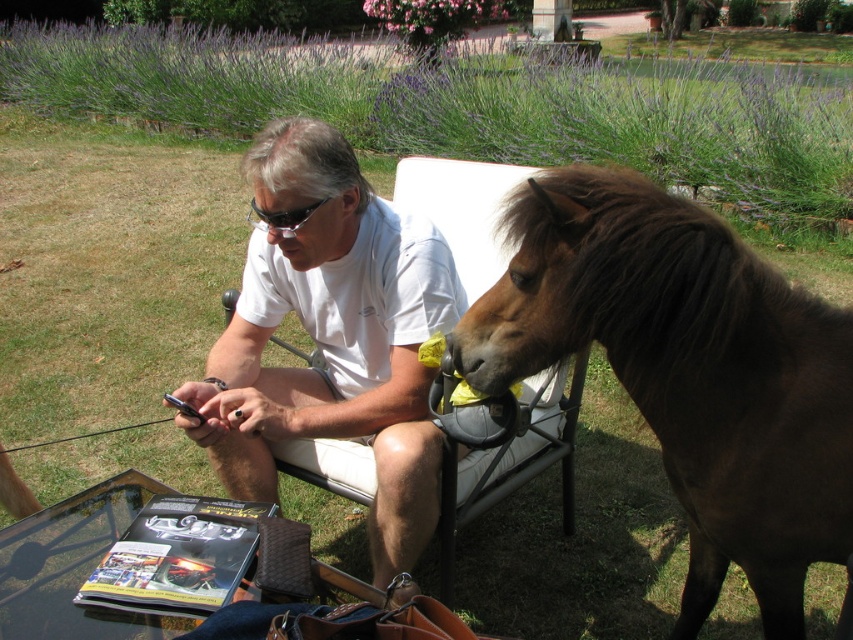
Question: Can you confirm if white cotton shirt at center is positioned to the left of black plastic goggles at center?

Choices:
 (A) yes
 (B) no

Answer: (B)

Question: Can you confirm if brown glossy horse at right is smaller than black plastic goggles at center?

Choices:
 (A) no
 (B) yes

Answer: (A)

Question: Which point appears farthest from the camera in this image?

Choices:
 (A) (695, 400)
 (B) (292, 227)
 (C) (260, 387)

Answer: (C)

Question: Among these objects, which one is nearest to the camera?

Choices:
 (A) white cotton shirt at center
 (B) brown glossy horse at right

Answer: (B)

Question: Is brown glossy horse at right to the left of white cotton shirt at center from the viewer's perspective?

Choices:
 (A) no
 (B) yes

Answer: (A)

Question: Which object is the closest to the black plastic goggles at center?

Choices:
 (A) white cotton shirt at center
 (B) brown glossy horse at right

Answer: (A)